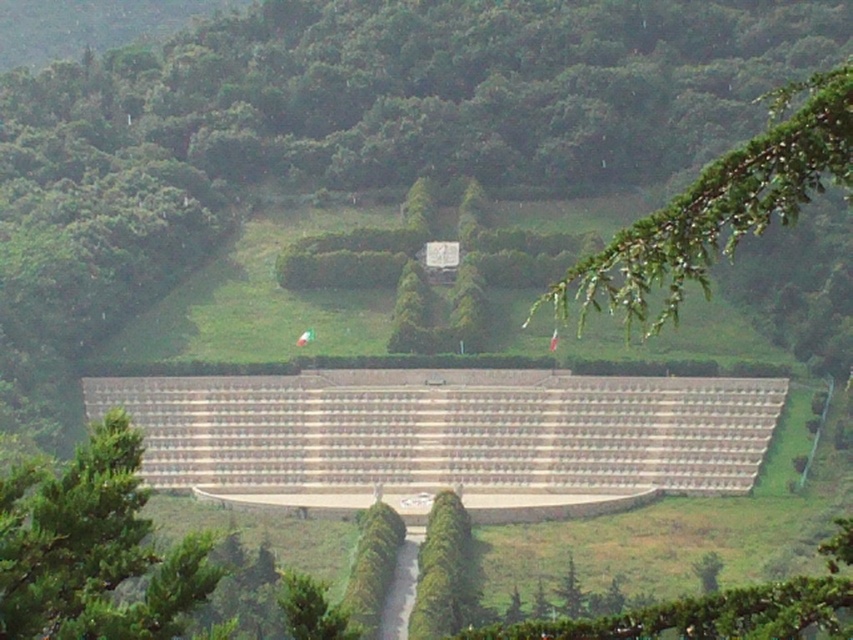
You are standing at the entrance of the memorial and see two trees at the center. Which tree is closer to you between the green textured tree at center and the green leafy tree at center?

The green textured tree at center is closer to you because it is positioned in front of the green leafy tree at center.

You are standing at the entrance of the memorial structure and see the point marked as point (91, 547). What is the closest object to this point?

The closest object to point (91, 547) is the green textured tree at center.